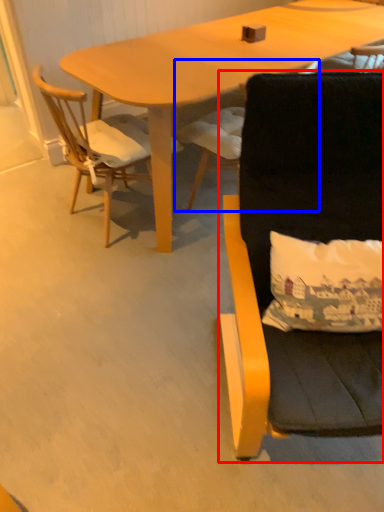
Question: Which object appears farthest to the camera in this image, chair (highlighted by a red box) or chair (highlighted by a blue box)?

Choices:
 (A) chair
 (B) chair

Answer: (B)